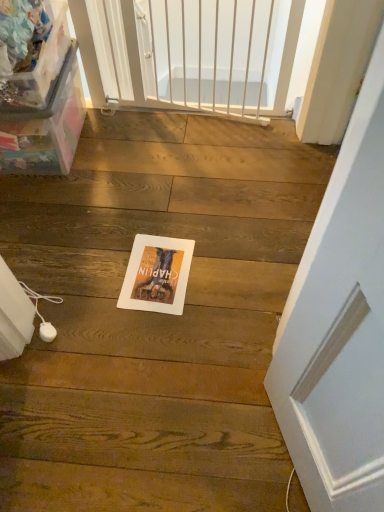
Question: From a real-world perspective, is white metal gate at upper center above or below matte paper postcard at center?

Choices:
 (A) below
 (B) above

Answer: (B)

Question: From the image's perspective, relative to matte paper postcard at center, is white metal gate at upper center above or below?

Choices:
 (A) above
 (B) below

Answer: (A)

Question: Estimate the real-world distances between objects in this image. Which object is farther from the transparent plastic box at left?

Choices:
 (A) matte paper postcard at center
 (B) white metal gate at upper center

Answer: (A)

Question: Based on their relative distances, which object is nearer to the transparent plastic box at left?

Choices:
 (A) white metal gate at upper center
 (B) matte paper postcard at center

Answer: (A)